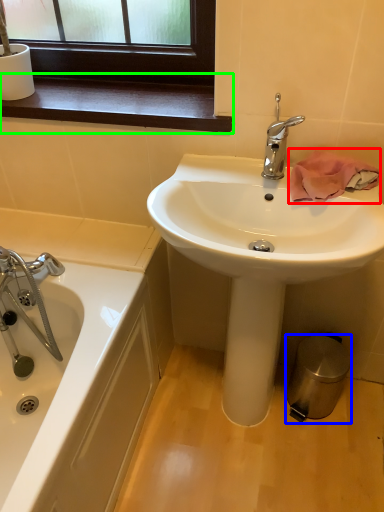
Question: Which object is positioned closest to bath towel (highlighted by a red box)? Select from trash bin/can (highlighted by a blue box) and window sill (highlighted by a green box).

Choices:
 (A) trash bin/can
 (B) window sill

Answer: (B)